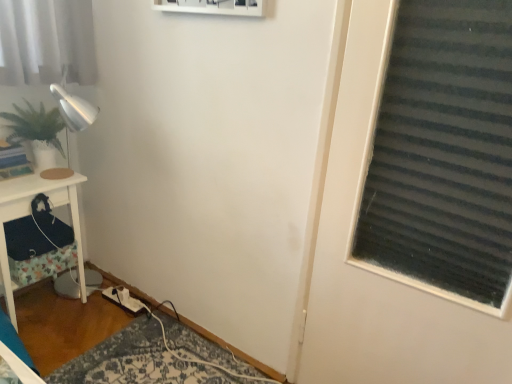
Question: From a real-world perspective, is green matte plant at left positioned under white wood side table at left based on gravity?

Choices:
 (A) yes
 (B) no

Answer: (B)

Question: From a real-world perspective, is green matte plant at left physically above white wood side table at left?

Choices:
 (A) yes
 (B) no

Answer: (A)

Question: Is green matte plant at left not within white wood side table at left?

Choices:
 (A) yes
 (B) no

Answer: (A)

Question: Would you say green matte plant at left contains white wood side table at left?

Choices:
 (A) yes
 (B) no

Answer: (B)

Question: Does green matte plant at left have a larger size compared to white wood side table at left?

Choices:
 (A) yes
 (B) no

Answer: (B)

Question: Is green matte plant at left thinner than white wood side table at left?

Choices:
 (A) no
 (B) yes

Answer: (B)

Question: Are green matte plant at left and white fabric extension cord at lower left beside each other?

Choices:
 (A) no
 (B) yes

Answer: (A)

Question: From a real-world perspective, is green matte plant at left located higher than white fabric extension cord at lower left?

Choices:
 (A) no
 (B) yes

Answer: (B)

Question: From the image's perspective, is green matte plant at left located above white fabric extension cord at lower left?

Choices:
 (A) no
 (B) yes

Answer: (B)

Question: Does green matte plant at left have a larger size compared to white fabric extension cord at lower left?

Choices:
 (A) no
 (B) yes

Answer: (B)

Question: Is green matte plant at left positioned with its back to white fabric extension cord at lower left?

Choices:
 (A) no
 (B) yes

Answer: (A)

Question: Are green matte plant at left and white fabric extension cord at lower left far apart?

Choices:
 (A) no
 (B) yes

Answer: (A)

Question: Is white wood side table at left to the right of green matte plant at left from the viewer's perspective?

Choices:
 (A) no
 (B) yes

Answer: (A)